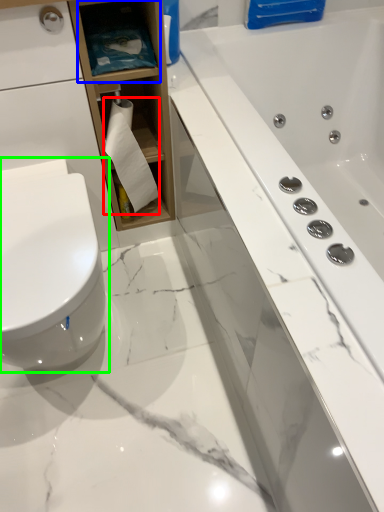
Question: Which is nearer to the toilet paper (highlighted by a red box)? shelf (highlighted by a blue box) or toilet (highlighted by a green box).

Choices:
 (A) shelf
 (B) toilet

Answer: (A)